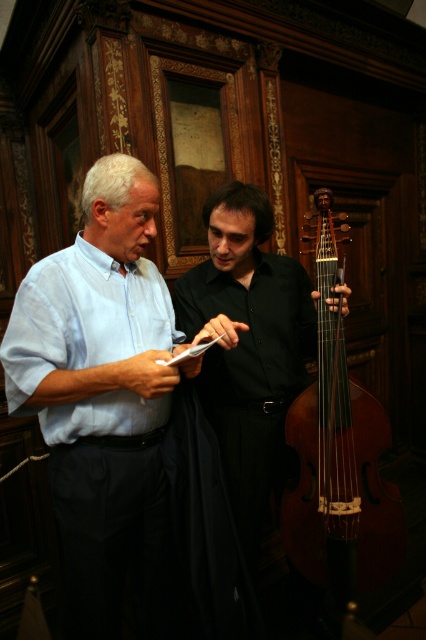
Between light blue cotton shirt at center and black smooth shirt at center, which one is positioned lower?

Positioned lower is light blue cotton shirt at center.

Can you confirm if light blue cotton shirt at center is wider than black smooth shirt at center?

No.

This screenshot has width=426, height=640. Identify the location of light blue cotton shirt at center. (104, 401).

From the picture: Which of these two, black smooth shirt at center or brown wooden cello at center, stands taller?

With more height is brown wooden cello at center.

Between point (256, 230) and point (347, 403), which one is positioned behind?

Point (256, 230)

Where is `black smooth shirt at center`? This screenshot has width=426, height=640. black smooth shirt at center is located at coordinates (247, 346).

Who is more distant from viewer, [34,339] or [298,561]?

Positioned behind is point [298,561].

Find the location of `light blue cotton shirt at center`. light blue cotton shirt at center is located at coordinates pyautogui.click(x=104, y=401).